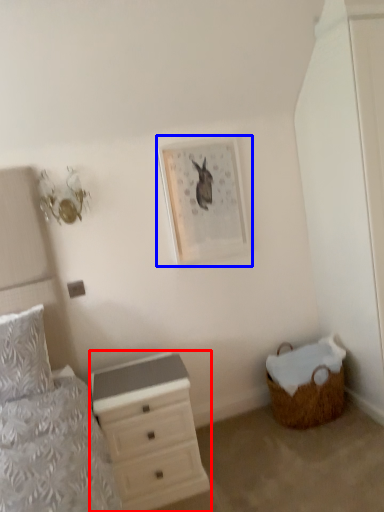
Question: Among these objects, which one is farthest to the camera, chest of drawers (highlighted by a red box) or picture frame (highlighted by a blue box)?

Choices:
 (A) chest of drawers
 (B) picture frame

Answer: (B)